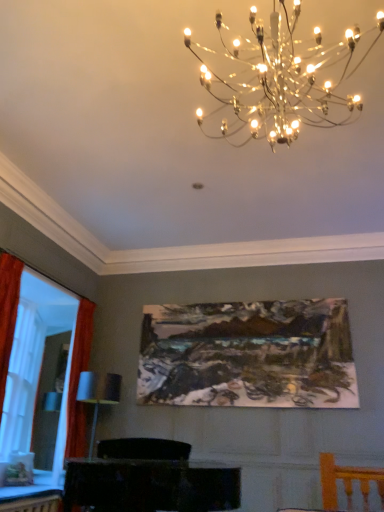
Question: Is oil painting at center outside of matte black cabinet at lower center?

Choices:
 (A) no
 (B) yes

Answer: (B)

Question: From the image's perspective, is oil painting at center on top of matte black cabinet at lower center?

Choices:
 (A) yes
 (B) no

Answer: (A)

Question: Considering the relative sizes of oil painting at center and matte black cabinet at lower center in the image provided, is oil painting at center bigger than matte black cabinet at lower center?

Choices:
 (A) yes
 (B) no

Answer: (B)

Question: Is the position of oil painting at center more distant than that of matte black cabinet at lower center?

Choices:
 (A) no
 (B) yes

Answer: (B)

Question: From a real-world perspective, does oil painting at center stand above matte black cabinet at lower center?

Choices:
 (A) no
 (B) yes

Answer: (B)

Question: Considering the positions of point (301, 396) and point (120, 460), is point (301, 396) closer or farther from the camera than point (120, 460)?

Choices:
 (A) farther
 (B) closer

Answer: (A)

Question: Relative to matte black cabinet at lower center, is oil painting at center in front or behind?

Choices:
 (A) behind
 (B) front

Answer: (A)

Question: Considering the relative positions of oil painting at center and matte black cabinet at lower center in the image provided, is oil painting at center to the left or to the right of matte black cabinet at lower center?

Choices:
 (A) left
 (B) right

Answer: (B)

Question: Is oil painting at center inside or outside of matte black cabinet at lower center?

Choices:
 (A) outside
 (B) inside

Answer: (A)

Question: Based on their sizes in the image, would you say wooden table at lower left is bigger or smaller than matte black cabinet at lower center?

Choices:
 (A) small
 (B) big

Answer: (A)

Question: From a real-world perspective, is wooden table at lower left positioned above or below matte black cabinet at lower center?

Choices:
 (A) above
 (B) below

Answer: (B)

Question: Considering the relative positions of wooden table at lower left and matte black cabinet at lower center in the image provided, is wooden table at lower left to the left or to the right of matte black cabinet at lower center?

Choices:
 (A) right
 (B) left

Answer: (B)

Question: Considering the positions of wooden table at lower left and matte black cabinet at lower center in the image, is wooden table at lower left taller or shorter than matte black cabinet at lower center?

Choices:
 (A) tall
 (B) short

Answer: (B)

Question: Based on their positions, is metallic chandelier at upper center located to the left or right of matte orange curtain at left?

Choices:
 (A) left
 (B) right

Answer: (B)

Question: In the image, is metallic chandelier at upper center positioned in front of or behind matte orange curtain at left?

Choices:
 (A) front
 (B) behind

Answer: (A)